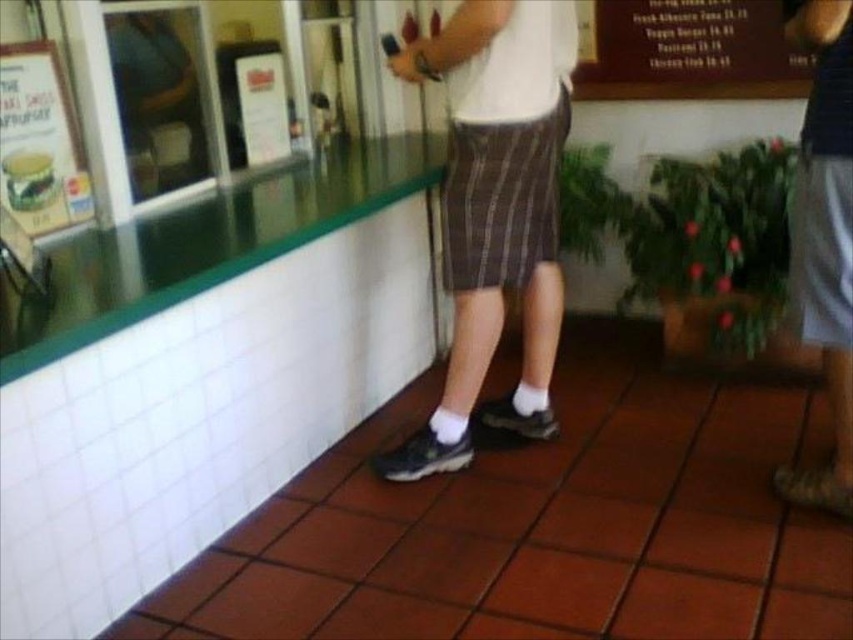
Question: Which point appears closest to the camera in this image?

Choices:
 (A) (518, 250)
 (B) (12, 77)
 (C) (825, 506)
 (D) (708, 74)

Answer: (B)

Question: Which of the following is the closest to the observer?

Choices:
 (A) (799, 276)
 (B) (645, 56)
 (C) (428, 64)
 (D) (28, 61)

Answer: (D)

Question: Observing the image, what is the correct spatial positioning of gray cotton shorts at right in reference to wooden sign at upper right?

Choices:
 (A) above
 (B) below

Answer: (B)

Question: Is white cotton socks at lower center above gray cotton shorts at right?

Choices:
 (A) yes
 (B) no

Answer: (A)

Question: Based on their relative distances, which object is nearer to the wooden sign at upper right?

Choices:
 (A) matte paper menu at upper left
 (B) white cotton socks at lower center
 (C) gray cotton shorts at right

Answer: (B)

Question: Can you confirm if wooden sign at upper right is thinner than matte paper menu at upper left?

Choices:
 (A) yes
 (B) no

Answer: (B)